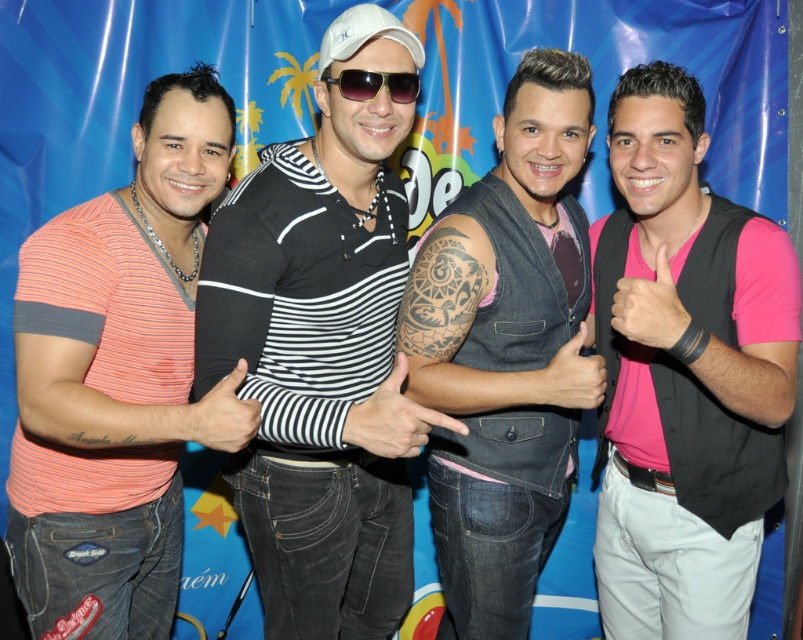
What is the color and pattern of the clothing item worn by the man at the point marked as point (683, 372)?

The clothing item at point (683, 372) is a pink matte vest at right.

You are designing a layout for a promotional poster and need to place a decorative frame around both the matte coral striped shirt at left and the sunglasses at center. Based on their positions in the image, which object should you make the frame larger for to ensure it accommodates their width?

The matte coral striped shirt at left might be wider than sunglasses at center, so the frame for the matte coral striped shirt at left should be larger to accommodate its width.

You are organizing a photo shoot and need to ensure that the black striped shirt at center and the denim vest at center are visible in the frame. Given their sizes, which clothing item should you focus on positioning closer to the camera to ensure both are clearly visible?

The black striped shirt at center is wider than the denim vest at center, so positioning the black striped shirt at center closer to the camera will help ensure both items are clearly visible.